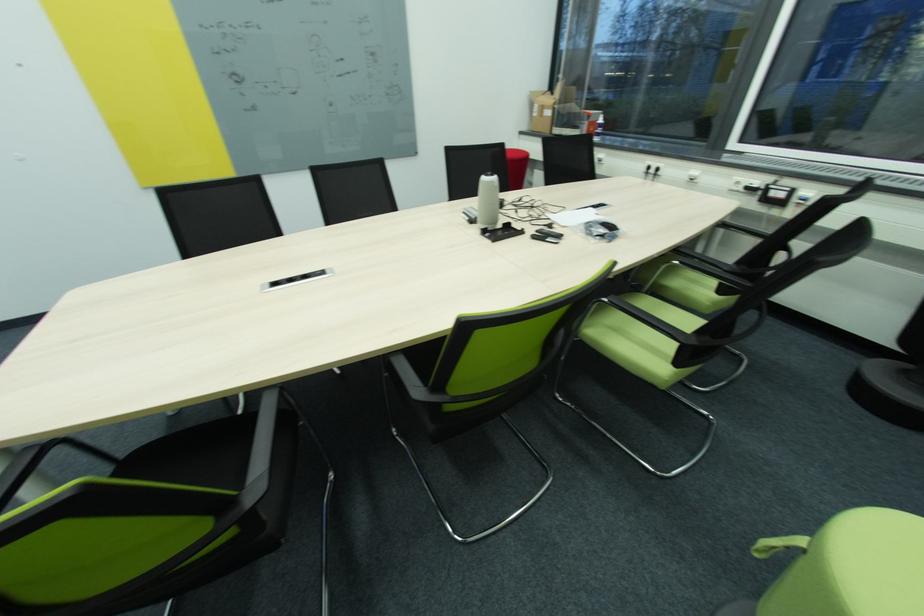
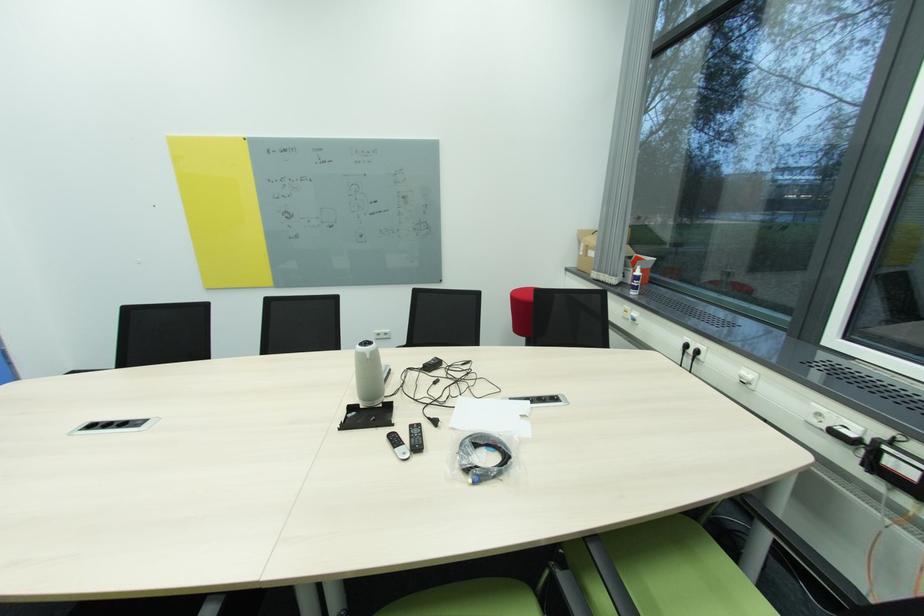
The point at (549, 227) is marked in the first image. Where is the corresponding point in the second image?

(433, 419)